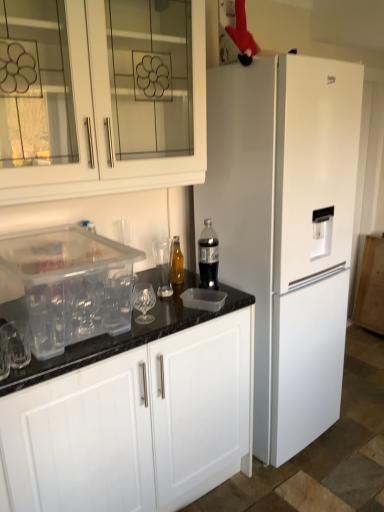
Question: Is transparent plastic container at lower left turned away from translucent plastic bottle at center, which is the 2th bottle from back to front?

Choices:
 (A) no
 (B) yes

Answer: (A)

Question: From the image's perspective, is transparent plastic container at lower left on translucent plastic bottle at center, which is the 2th bottle from back to front?

Choices:
 (A) yes
 (B) no

Answer: (B)

Question: Is the depth of transparent plastic container at lower left greater than that of translucent plastic bottle at center, positioned as the 1th bottle in front-to-back order?

Choices:
 (A) no
 (B) yes

Answer: (A)

Question: Is transparent plastic container at lower left not within translucent plastic bottle at center, arranged as the 1th bottle when viewed from the right?

Choices:
 (A) yes
 (B) no

Answer: (A)

Question: Considering the relative positions of transparent plastic container at lower left and translucent plastic bottle at center, arranged as the 2th bottle when viewed from the left, in the image provided, is transparent plastic container at lower left to the right of translucent plastic bottle at center, arranged as the 2th bottle when viewed from the left, from the viewer's perspective?

Choices:
 (A) yes
 (B) no

Answer: (B)

Question: Can you confirm if transparent plastic container at lower left is wider than translucent plastic bottle at center, positioned as the 1th bottle in front-to-back order?

Choices:
 (A) yes
 (B) no

Answer: (A)

Question: Is there a large distance between white matte refrigerator at right and transparent plastic container at lower left?

Choices:
 (A) no
 (B) yes

Answer: (A)

Question: Is white matte refrigerator at right closer to the viewer compared to transparent plastic container at lower left?

Choices:
 (A) no
 (B) yes

Answer: (A)

Question: From a real-world perspective, is white matte refrigerator at right positioned over transparent plastic container at lower left based on gravity?

Choices:
 (A) no
 (B) yes

Answer: (A)

Question: Can you confirm if white matte refrigerator at right is wider than transparent plastic container at lower left?

Choices:
 (A) yes
 (B) no

Answer: (A)

Question: Considering the relative sizes of white matte refrigerator at right and transparent plastic container at lower left in the image provided, is white matte refrigerator at right thinner than transparent plastic container at lower left?

Choices:
 (A) no
 (B) yes

Answer: (A)

Question: Is white matte refrigerator at right next to transparent plastic container at lower left and touching it?

Choices:
 (A) no
 (B) yes

Answer: (A)

Question: From the image's perspective, is translucent plastic bottle at center, arranged as the 1th bottle when viewed from the right, above translucent glass bottle at center, arranged as the first bottle when viewed from the back?

Choices:
 (A) no
 (B) yes

Answer: (B)